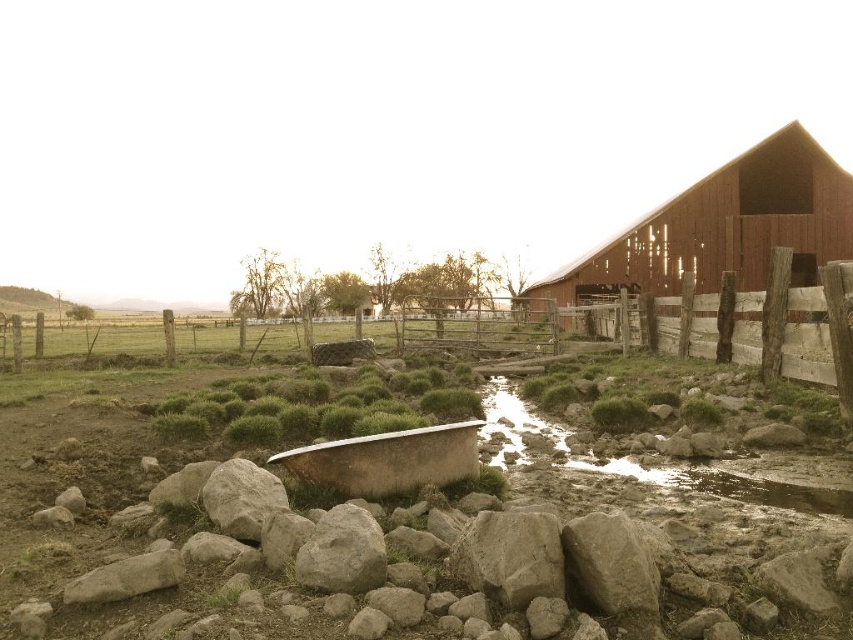
Which of these two, smooth wooden barn at upper right or rusty metal tub at center, stands taller?

Standing taller between the two is smooth wooden barn at upper right.

Who is shorter, smooth wooden barn at upper right or rusty metal tub at center?

With less height is rusty metal tub at center.

Does point (730, 189) lie behind point (346, 486)?

Yes, it is behind point (346, 486).

At what (x,y) coordinates should I click in order to perform the action: click on smooth wooden barn at upper right. Please return your answer as a coordinate pair (x, y). Image resolution: width=853 pixels, height=640 pixels. Looking at the image, I should click on (724, 227).

Can you confirm if smooth wooden barn at upper right is shorter than muddy stone stream at center?

No, smooth wooden barn at upper right is not shorter than muddy stone stream at center.

Which is more to the right, smooth wooden barn at upper right or muddy stone stream at center?

smooth wooden barn at upper right

Does point (618, 268) lie behind point (839, 468)?

Yes, it is.

Identify the location of smooth wooden barn at upper right. This screenshot has height=640, width=853. (724, 227).

Does muddy stone stream at center lie in front of gray rough rock at center?

No, muddy stone stream at center is further to the viewer.

Who is more distant from viewer, (741, 477) or (332, 512)?

The point (741, 477) is more distant.

Find the location of `muddy stone stream at center`. muddy stone stream at center is located at coordinates (676, 461).